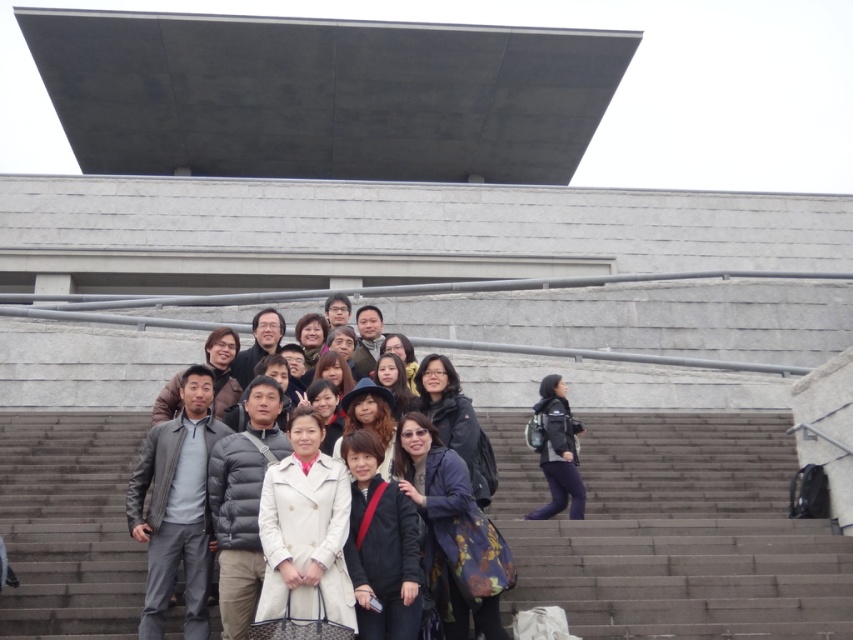
You are a photographer standing at the bottom of the stairs. You want to ensure that both the beige wool coat at center and the matte black jacket at center are in focus in your photo. Given that your camera has a depth of field that can cover 40 feet, will you be able to capture both subjects clearly?

The distance between the beige wool coat at center and the matte black jacket at center is 42.78 feet. Since the camera can only cover 40 feet, it won not be able to capture both subjects clearly in focus.

You are a photographer trying to arrange two people wearing the gray matte jacket at center and the beige wool coat at center so that their jackets are visible in the photo. Since the jackets have different widths, which jacket should you place closer to the camera to ensure both jackets are fully visible in the frame?

The gray matte jacket at center has a smaller width than the beige wool coat at center. To ensure both jackets are fully visible, place the beige wool coat at center closer to the camera since wider objects need more space when viewed from a distance. Alternatively, position the narrower gray matte jacket at center closer to maintain proportions.

You are a photographer trying to capture a candid shot of the matte black glasses at center without including the dark blue fabric jacket at right in the frame. Given their relative positions and sizes, is this possible?

The dark blue fabric jacket at right is taller than matte black glasses at center, so it might block the view. Adjust your angle or zoom to focus solely on the matte black glasses at center without the jacket overlapping.